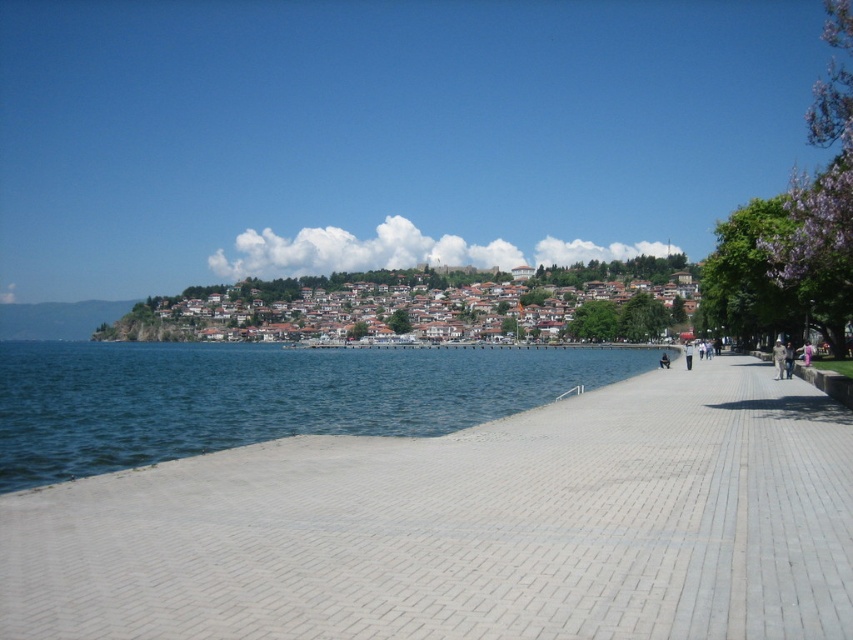
Is gray brick pavement at center behind blue water at lower left?

No, it is in front of blue water at lower left.

Is gray brick pavement at center positioned in front of blue water at lower left?

That is True.

Image resolution: width=853 pixels, height=640 pixels. What are the coordinates of `gray brick pavement at center` in the screenshot? It's located at (469, 528).

What are the coordinates of `gray brick pavement at center` in the screenshot? It's located at (469, 528).

Can you confirm if gray brick pavement at center is positioned to the right of brown tiled houses at center?

Yes, gray brick pavement at center is to the right of brown tiled houses at center.

Based on the photo, does gray brick pavement at center appear under brown tiled houses at center?

Yes, gray brick pavement at center is below brown tiled houses at center.

Which is behind, point (62, 504) or point (570, 330)?

The point (570, 330) is more distant.

This screenshot has height=640, width=853. What are the coordinates of `gray brick pavement at center` in the screenshot? It's located at (469, 528).

Is blue water at lower left positioned before brown tiled houses at center?

Yes.

Can you confirm if blue water at lower left is positioned above brown tiled houses at center?

No, blue water at lower left is not above brown tiled houses at center.

Describe the element at coordinates (258, 396) in the screenshot. I see `blue water at lower left` at that location.

This screenshot has height=640, width=853. I want to click on blue water at lower left, so click(258, 396).